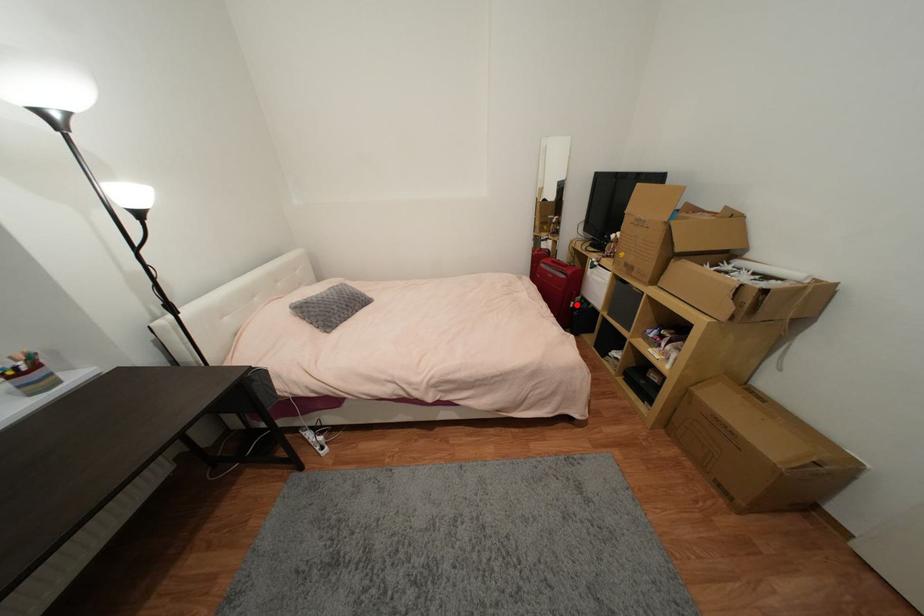
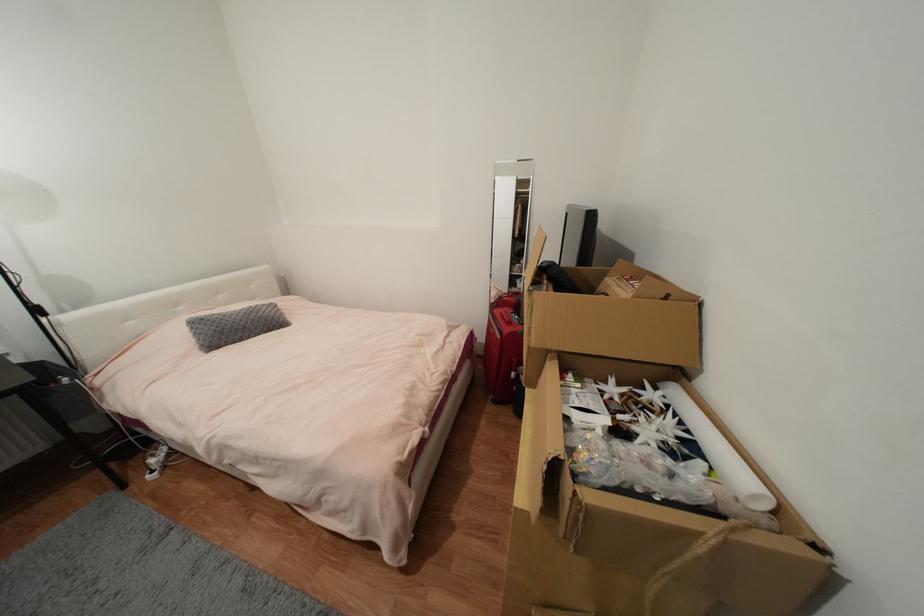
Find the pixel in the second image that matches the highlighted location in the first image.

(517, 375)